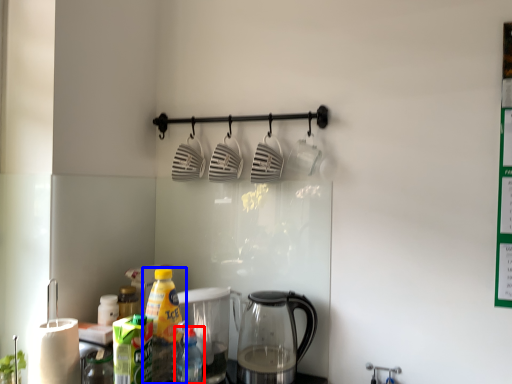
Question: Which object is closer to the camera taking this photo, bottle (highlighted by a red box) or bottle (highlighted by a blue box)?

Choices:
 (A) bottle
 (B) bottle

Answer: (A)